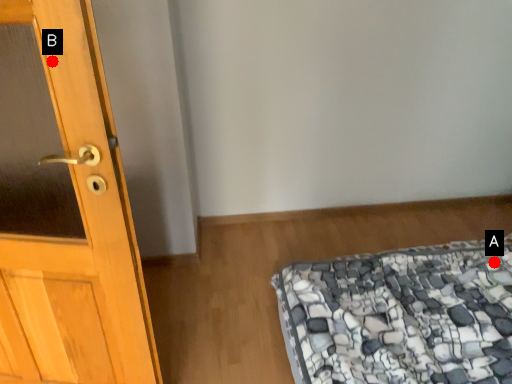
Question: Two points are circled on the image, labeled by A and B beside each circle. Which of the following is the farthest from the observer?

Choices:
 (A) A is further
 (B) B is further

Answer: (A)